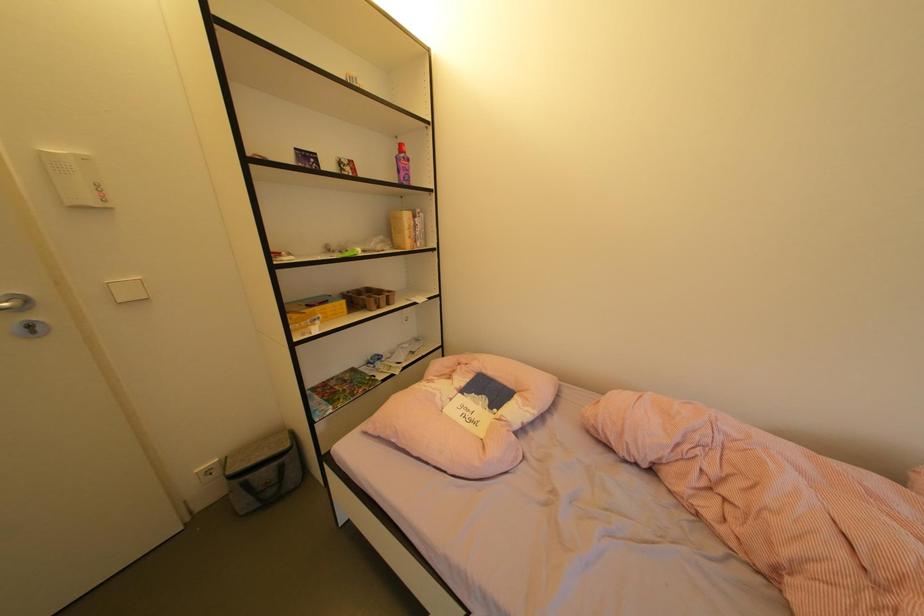
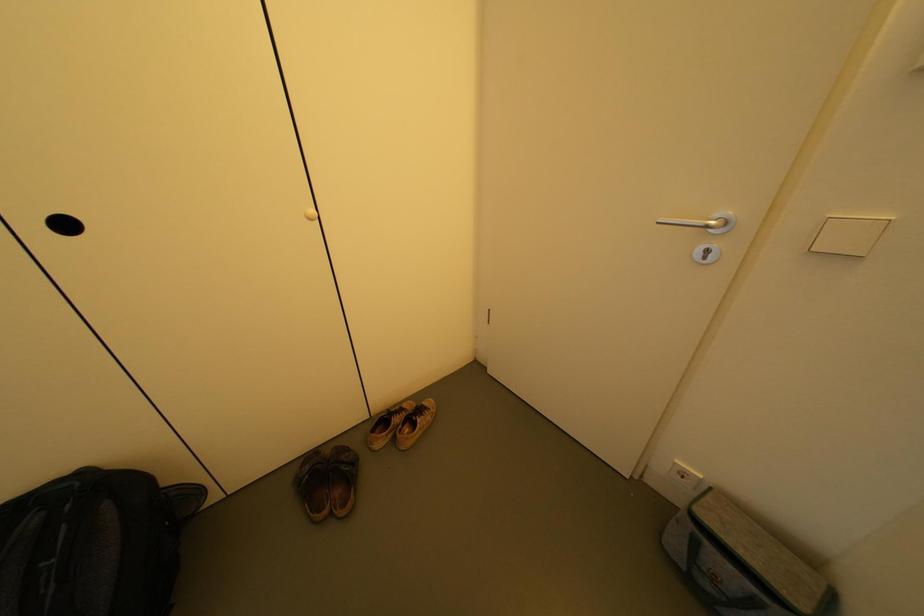
From the picture: First-person continuous shooting, in which direction is the camera rotating?

The camera rotated toward left-down.